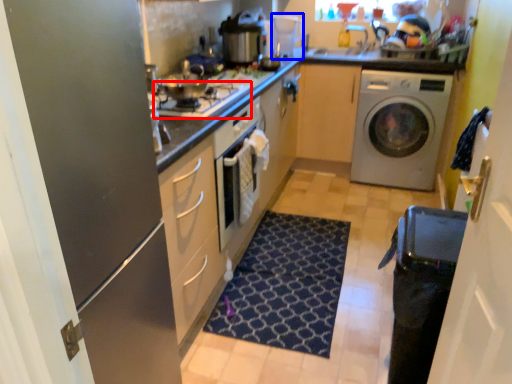
Question: Which object appears closest to the camera in this image, gas stove (highlighted by a red box) or coffee machine (highlighted by a blue box)?

Choices:
 (A) gas stove
 (B) coffee machine

Answer: (A)